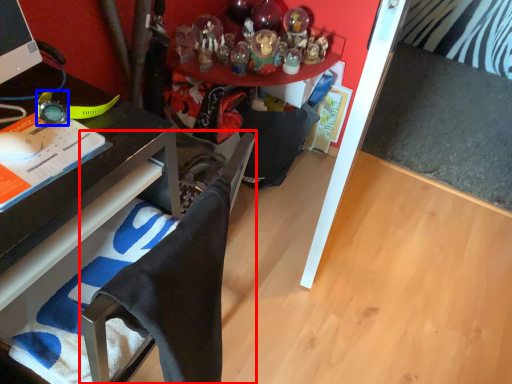
Question: Which point is further to the camera, computer chair (highlighted by a red box) or watch (highlighted by a blue box)?

Choices:
 (A) computer chair
 (B) watch

Answer: (B)